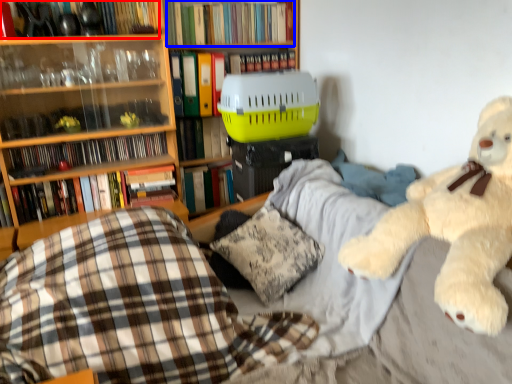
Question: Which object appears closest to the camera in this image, book (highlighted by a red box) or book (highlighted by a blue box)?

Choices:
 (A) book
 (B) book

Answer: (A)